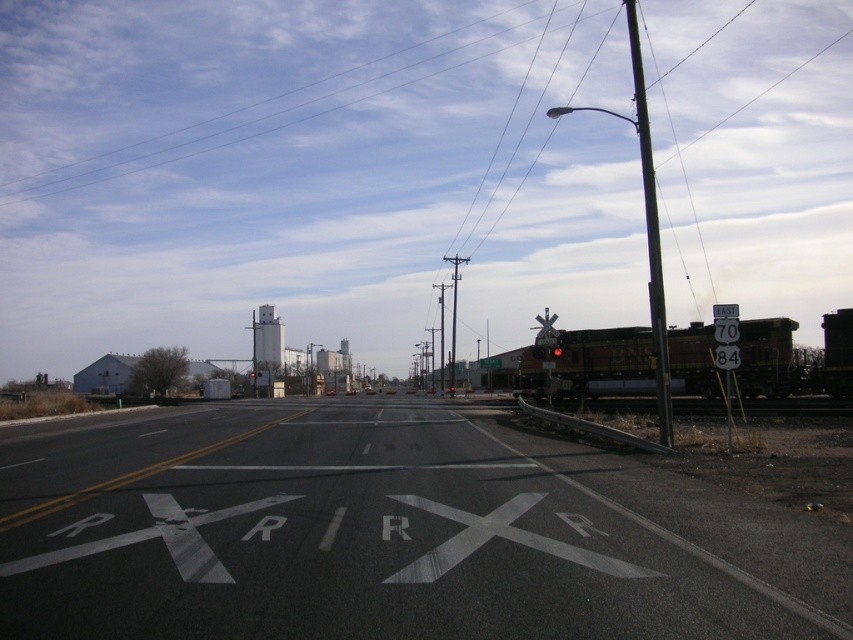
Where is `brown textured train at right`? brown textured train at right is located at coordinates (589, 364).

Is point (845, 337) behind point (712, 332)?

That is False.

Who is more distant from viewer, (581, 337) or (733, 330)?

Point (581, 337)

The height and width of the screenshot is (640, 853). Find the location of `brown textured train at right`. brown textured train at right is located at coordinates (589, 364).

Measure the distance from white asphalt road at center to metallic pole at right.

white asphalt road at center is 70.42 feet from metallic pole at right.

Which is above, white asphalt road at center or metallic pole at right?

metallic pole at right

Between point (283, 589) and point (660, 371), which one is positioned in front?

Point (283, 589) is more forward.

At what (x,y) coordinates should I click in order to perform the action: click on white asphalt road at center. Please return your answer as a coordinate pair (x, y). Looking at the image, I should click on (383, 532).

Who is lower down, white asphalt road at center or red glass traffic light at center?

white asphalt road at center is lower down.

Can you confirm if white asphalt road at center is taller than red glass traffic light at center?

Correct, white asphalt road at center is much taller as red glass traffic light at center.

Who is more forward, (317, 461) or (561, 352)?

Point (317, 461) is more forward.

At what (x,y) coordinates should I click in order to perform the action: click on white asphalt road at center. Please return your answer as a coordinate pair (x, y). The width and height of the screenshot is (853, 640). Looking at the image, I should click on (383, 532).